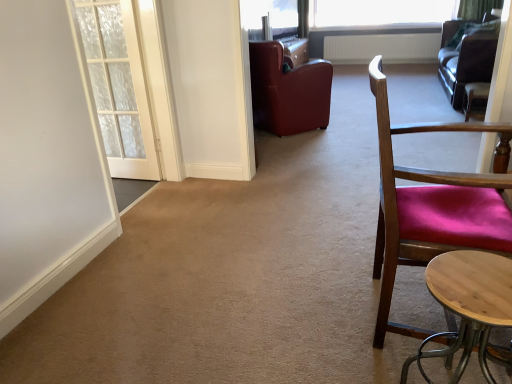
Find the location of a particular element. The width and height of the screenshot is (512, 384). blank space to the left of wooden chair with red cushion at right, the third chair in the back-to-front sequence is located at coordinates pos(304,324).